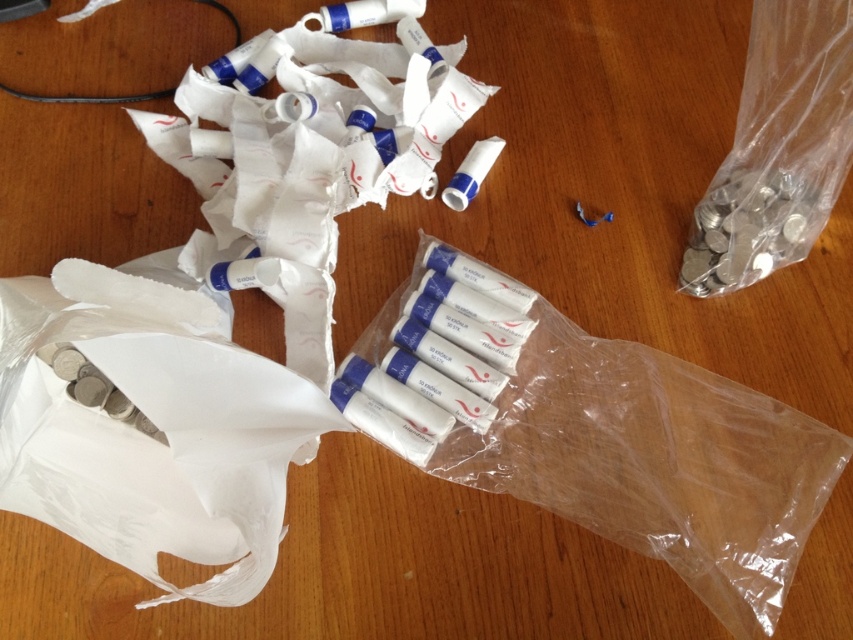
Between clear plastic bag at center and white paper bag at lower left, which one appears on the left side from the viewer's perspective?

white paper bag at lower left

Consider the image. Can you confirm if clear plastic bag at center is thinner than white paper bag at lower left?

No.

I want to click on clear plastic bag at center, so 593,432.

Image resolution: width=853 pixels, height=640 pixels. In order to click on clear plastic bag at center in this screenshot , I will do `click(593, 432)`.